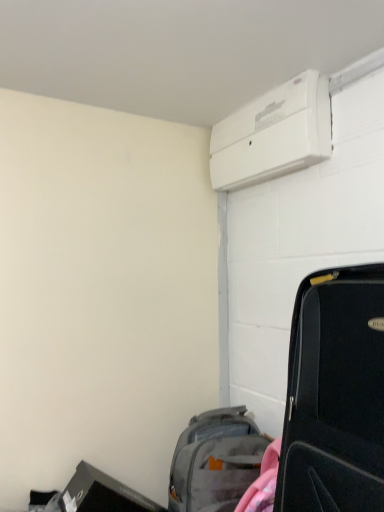
What do you see at coordinates (215, 461) in the screenshot?
I see `gray fabric backpack at lower center` at bounding box center [215, 461].

In order to click on gray fabric backpack at lower center in this screenshot , I will do `click(215, 461)`.

Describe the element at coordinates (335, 395) in the screenshot. I see `black matte suitcase at right` at that location.

Identify the location of black matte suitcase at right. (335, 395).

Where is `gray fabric backpack at lower center`? The width and height of the screenshot is (384, 512). gray fabric backpack at lower center is located at coordinates (215, 461).

Does gray fabric backpack at lower center appear on the left side of black matte suitcase at right?

Indeed, gray fabric backpack at lower center is positioned on the left side of black matte suitcase at right.

Is the position of gray fabric backpack at lower center more distant than that of black matte suitcase at right?

That is True.

Does point (185, 439) appear closer or farther from the camera than point (380, 511)?

Point (185, 439).

From the image's perspective, who appears lower, gray fabric backpack at lower center or black matte suitcase at right?

gray fabric backpack at lower center.

From a real-world perspective, is gray fabric backpack at lower center beneath black matte suitcase at right?

Yes, from a real-world perspective, gray fabric backpack at lower center is beneath black matte suitcase at right.

Between gray fabric backpack at lower center and black matte suitcase at right, which one has smaller width?

gray fabric backpack at lower center.

Is gray fabric backpack at lower center taller or shorter than black matte suitcase at right?

In the image, gray fabric backpack at lower center appears to be shorter than black matte suitcase at right.

Can you confirm if gray fabric backpack at lower center is bigger than black matte suitcase at right?

Incorrect, gray fabric backpack at lower center is not larger than black matte suitcase at right.

Would you say gray fabric backpack at lower center is outside black matte suitcase at right?

Yes, gray fabric backpack at lower center is outside of black matte suitcase at right.

Are gray fabric backpack at lower center and black matte suitcase at right beside each other?

No, gray fabric backpack at lower center is not touching black matte suitcase at right.

Is gray fabric backpack at lower center positioned with its back to black matte suitcase at right?

No.

How different are the orientations of gray fabric backpack at lower center and black matte suitcase at right in degrees?

There is a 13.1-degree angle between the facing directions of gray fabric backpack at lower center and black matte suitcase at right.

Image resolution: width=384 pixels, height=512 pixels. In order to click on suitcase in front of the gray fabric backpack at lower center in this screenshot , I will do `click(335, 395)`.

Is black matte suitcase at right at the right side of gray fabric backpack at lower center?

Yes, black matte suitcase at right is to the right of gray fabric backpack at lower center.

Between black matte suitcase at right and gray fabric backpack at lower center, which one is positioned in front?

black matte suitcase at right is more forward.

Considering the positions of points (310, 337) and (190, 486), is point (310, 337) closer to camera compared to point (190, 486)?

Yes.

From the image's perspective, between black matte suitcase at right and gray fabric backpack at lower center, which one is located above?

black matte suitcase at right, from the image's perspective.

From a real-world perspective, is black matte suitcase at right under gray fabric backpack at lower center?

No, from a real-world perspective, black matte suitcase at right is not under gray fabric backpack at lower center.

Can you confirm if black matte suitcase at right is thinner than gray fabric backpack at lower center?

In fact, black matte suitcase at right might be wider than gray fabric backpack at lower center.

Between black matte suitcase at right and gray fabric backpack at lower center, which one has more height?

black matte suitcase at right.

Which of these two, black matte suitcase at right or gray fabric backpack at lower center, is bigger?

Bigger between the two is black matte suitcase at right.

Based on the photo, is gray fabric backpack at lower center completely or partially inside black matte suitcase at right?

Definitely not — gray fabric backpack at lower center is not inside black matte suitcase at right.

Is black matte suitcase at right directly adjacent to gray fabric backpack at lower center?

No.

Could you tell me if black matte suitcase at right is turned towards gray fabric backpack at lower center?

No, black matte suitcase at right is not turned towards gray fabric backpack at lower center.

Looking at this image, what's the angular difference between black matte suitcase at right and gray fabric backpack at lower center's facing directions?

The angle between the facing direction of black matte suitcase at right and the facing direction of gray fabric backpack at lower center is 13.1 degrees.

Where is `luggage and bags on the left of the black matte suitcase at right`? luggage and bags on the left of the black matte suitcase at right is located at coordinates (215, 461).

The width and height of the screenshot is (384, 512). I want to click on luggage and bags that is under the black matte suitcase at right (from a real-world perspective), so tap(215, 461).

Where is `suitcase above the gray fabric backpack at lower center (from a real-world perspective)`? Image resolution: width=384 pixels, height=512 pixels. suitcase above the gray fabric backpack at lower center (from a real-world perspective) is located at coordinates (335, 395).